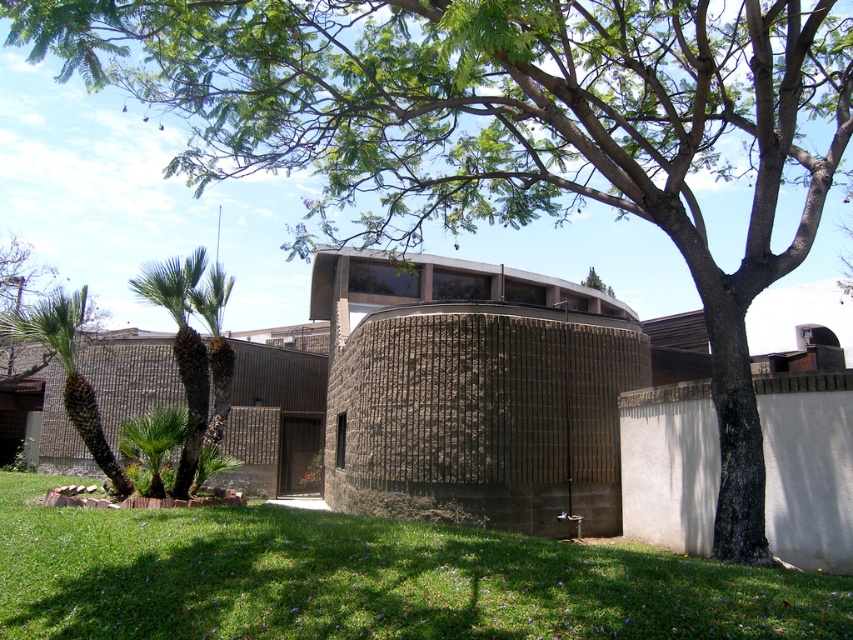
You are standing in front of the modern building and notice the green grass at lower center and the green leafy palm tree at left. From your vantage point, which object is positioned to the right of the other?

The green grass at lower center is to the right of the green leafy palm tree at left.

You are standing at the origin point of the coordinate system in the image. You need to walk towards the green grass at lower center. What are the coordinates you should head towards?

The coordinates you should head towards are approximately 0.906 in the x direction and 0.433 in the y direction.

You are standing on the green grass at lower center and want to walk towards the green leafy palm tree at left. Which direction should you move to get closer to the palm tree?

The green grass at lower center is in front of the green leafy palm tree at left, so you should move backward to get closer to the palm tree.